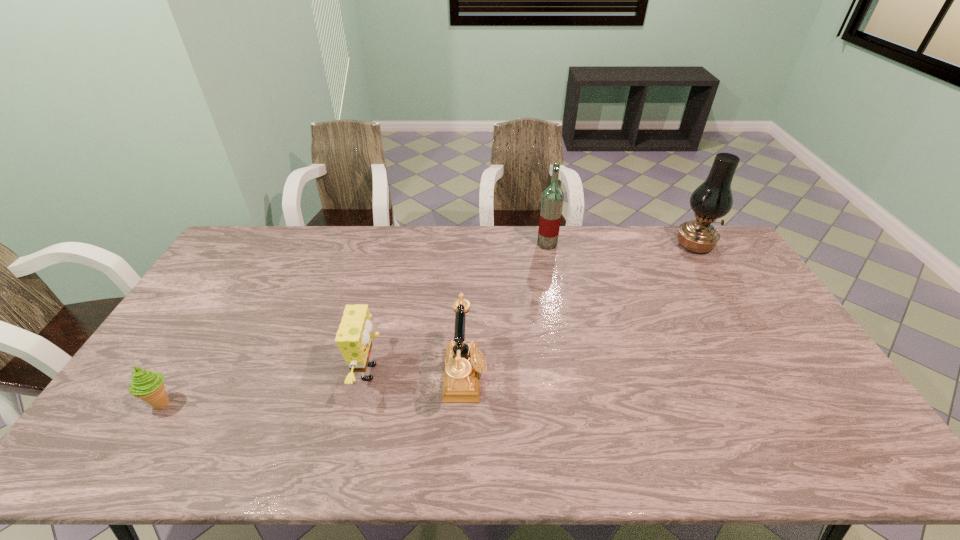
At what (x,y) coordinates should I click in order to perform the action: click on the rightmost object. Please return your answer as a coordinate pair (x, y). The height and width of the screenshot is (540, 960). Looking at the image, I should click on (713, 199).

The width and height of the screenshot is (960, 540). What are the coordinates of `the second object from right to left` in the screenshot? It's located at (552, 199).

Image resolution: width=960 pixels, height=540 pixels. Find the location of `the third object from right to left`. the third object from right to left is located at coordinates (464, 362).

Image resolution: width=960 pixels, height=540 pixels. Identify the location of sponge. (353, 338).

What are the coordinates of `icecream` in the screenshot? It's located at (147, 385).

Find the location of `the leftmost object`. the leftmost object is located at coordinates (147, 385).

Locate an element on the screen. This screenshot has width=960, height=540. free space located on the left of the oil lamp is located at coordinates (621, 245).

The width and height of the screenshot is (960, 540). I want to click on free space located 0.260m on the right of the fourth object from left to right, so click(x=627, y=244).

At what (x,y) coordinates should I click in order to perform the action: click on free space located on the dial of the third object from right to left. Please return your answer as a coordinate pair (x, y). Looking at the image, I should click on (523, 376).

Where is `vacant space located 0.240m on the front-facing side of the second object from left to right`? vacant space located 0.240m on the front-facing side of the second object from left to right is located at coordinates (475, 372).